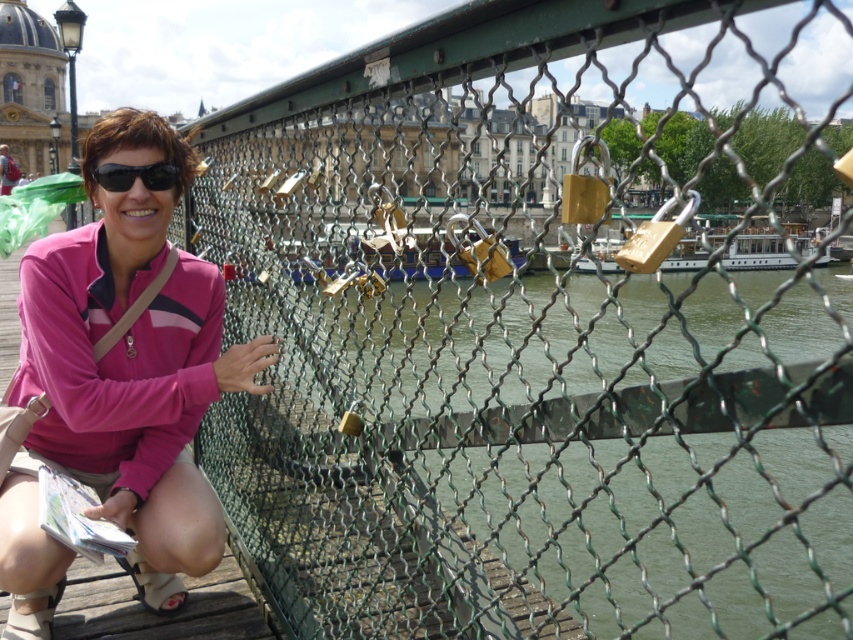
Describe the element at coordinates (120, 384) in the screenshot. The image size is (853, 640). I see `pink fabric at left` at that location.

Can you confirm if pink fabric at left is positioned below black matte sunglasses at left?

Yes, pink fabric at left is below black matte sunglasses at left.

Does point (80, 301) lie behind point (128, 188)?

No, (80, 301) is in front of (128, 188).

The image size is (853, 640). In order to click on pink fabric at left in this screenshot , I will do `click(120, 384)`.